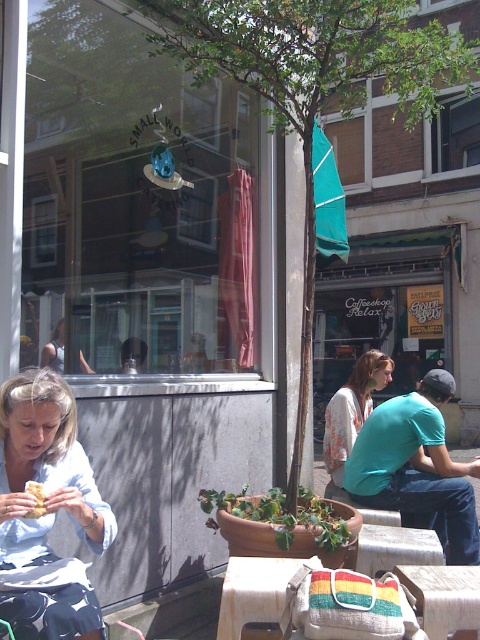
You are a photographer trying to capture both the white floral blouse at center and the golden crispy pastry at lower left in a single frame. Based on their positions and sizes, will you need to adjust your camera angle to include both?

The white floral blouse at center might be wider than golden crispy pastry at lower left, so you may need to adjust your camera angle to ensure both are fully visible in the frame.